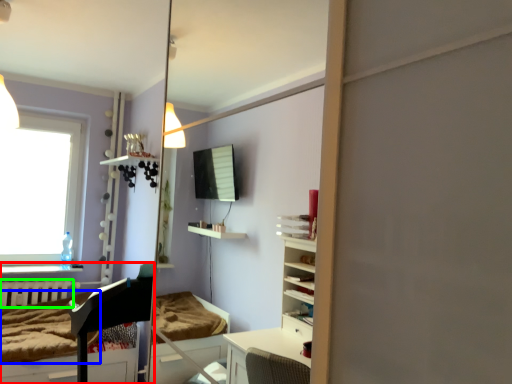
Question: Considering the real-world distances, which object is farthest from furniture (highlighted by a red box)? mattress (highlighted by a blue box) or radiator (highlighted by a green box)?

Choices:
 (A) mattress
 (B) radiator

Answer: (B)